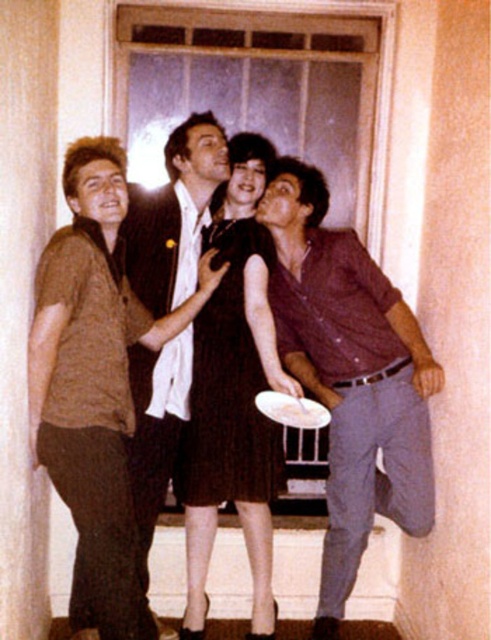
You are arranging a dinner party and need to place the purple cotton vest at right and the white glossy platter at center on a table. According to the scene, which item should be placed to the right of the other?

The purple cotton vest at right should be placed to the right of the white glossy platter at center.